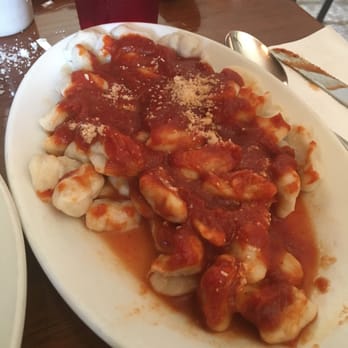
Where is `ceramic plates`? ceramic plates is located at coordinates (91, 278), (329, 211), (12, 271).